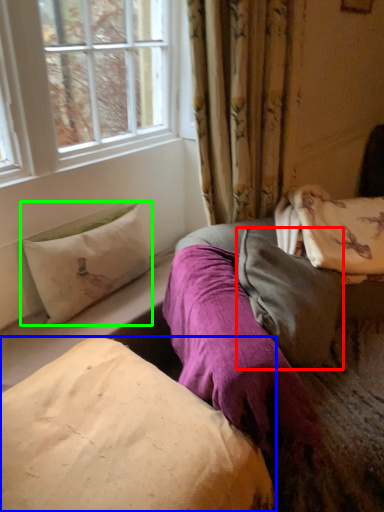
Question: Estimate the real-world distances between objects in this image. Which object is closer to pillow (highlighted by a red box), pillow (highlighted by a blue box) or pillow (highlighted by a green box)?

Choices:
 (A) pillow
 (B) pillow

Answer: (A)